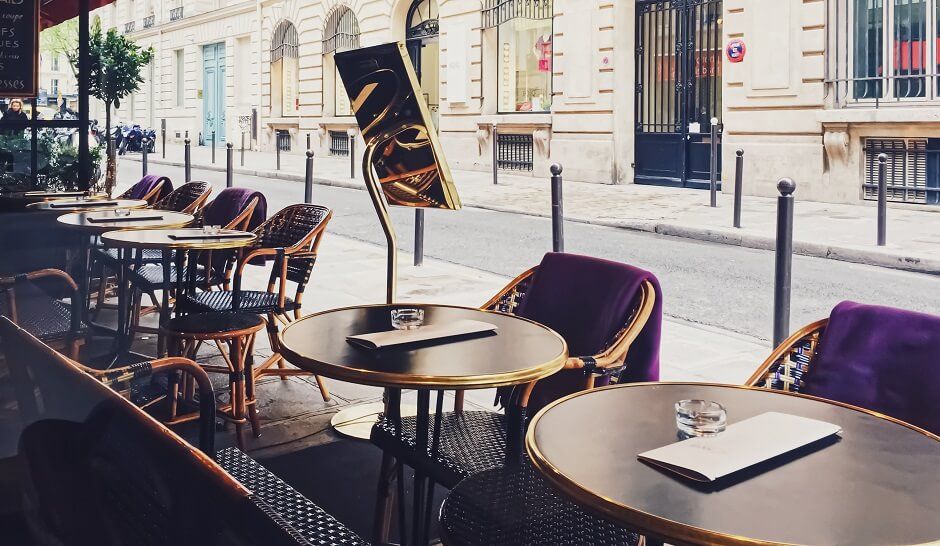
This screenshot has width=940, height=546. I want to click on menus on table, so click(717, 456), click(431, 336), click(215, 236), click(131, 219), click(85, 201).